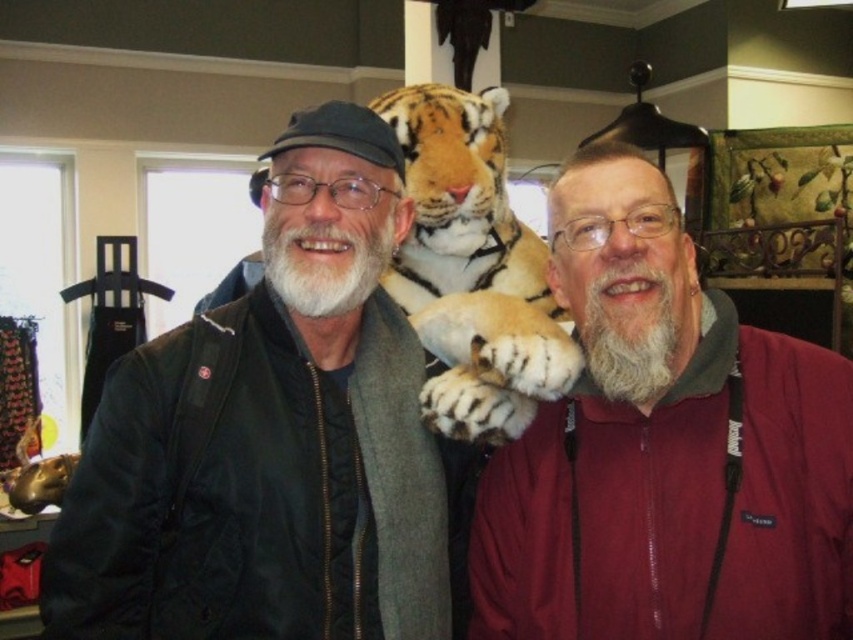
Question: Is maroon fleece jacket at center bigger than orange fur tiger at center?

Choices:
 (A) yes
 (B) no

Answer: (B)

Question: Which point is farther to the camera?

Choices:
 (A) (206, 611)
 (B) (553, 349)
 (C) (727, 604)

Answer: (B)

Question: Is black matte jacket at left positioned before maroon fleece jacket at center?

Choices:
 (A) no
 (B) yes

Answer: (A)

Question: Where is black matte jacket at left located in relation to orange fur tiger at center in the image?

Choices:
 (A) below
 (B) above

Answer: (A)

Question: Among these points, which one is farthest from the camera?

Choices:
 (A) 386,177
 (B) 695,460
 (C) 502,316

Answer: (C)

Question: Estimate the real-world distances between objects in this image. Which object is farther from the black matte jacket at left?

Choices:
 (A) maroon fleece jacket at center
 (B) orange fur tiger at center

Answer: (B)